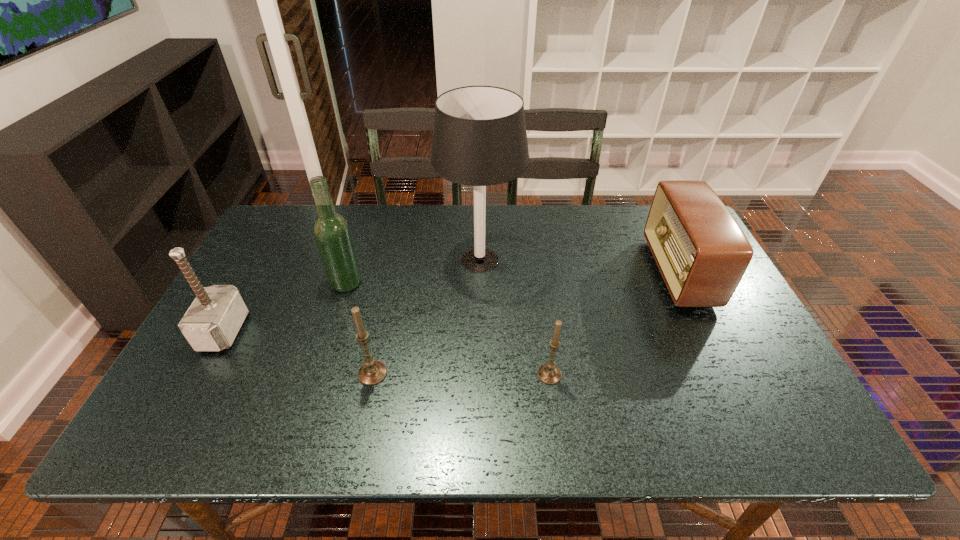
Locate an element on the screen. the fourth object from right to left is located at coordinates (372, 372).

The width and height of the screenshot is (960, 540). I want to click on the taller candle, so click(372, 372).

Image resolution: width=960 pixels, height=540 pixels. I want to click on the right candle, so click(x=549, y=373).

Where is `the shorter candle`? the shorter candle is located at coordinates coord(549,373).

I want to click on liquor, so click(332, 235).

The width and height of the screenshot is (960, 540). Identify the location of the second tallest object. point(332,235).

You are a GUI agent. You are given a task and a screenshot of the screen. Output one action in this format:
    pyautogui.click(x=<x>, y=<y>)
    Task: Click on the rightmost object
    
    Given the screenshot: What is the action you would take?
    point(701,252)

Image resolution: width=960 pixels, height=540 pixels. What are the coordinates of `the fourth object from left to right` in the screenshot? It's located at (479, 139).

You are a GUI agent. You are given a task and a screenshot of the screen. Output one action in this format:
    pyautogui.click(x=<x>, y=<y>)
    Task: Click on the table lamp
    The image size is (960, 540).
    Given the screenshot: What is the action you would take?
    pyautogui.click(x=479, y=139)

Locate an element on the screen. This screenshot has width=960, height=540. hammer is located at coordinates (211, 323).